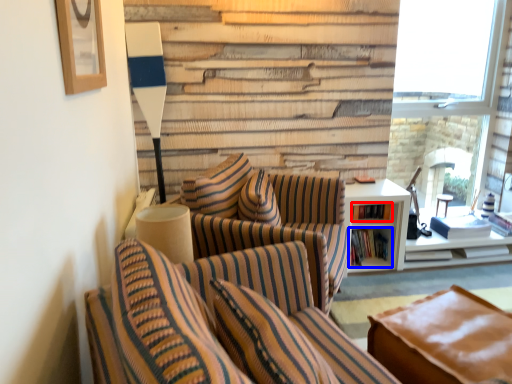
Question: Among these objects, which one is farthest to the camera, book (highlighted by a red box) or book (highlighted by a blue box)?

Choices:
 (A) book
 (B) book

Answer: (A)